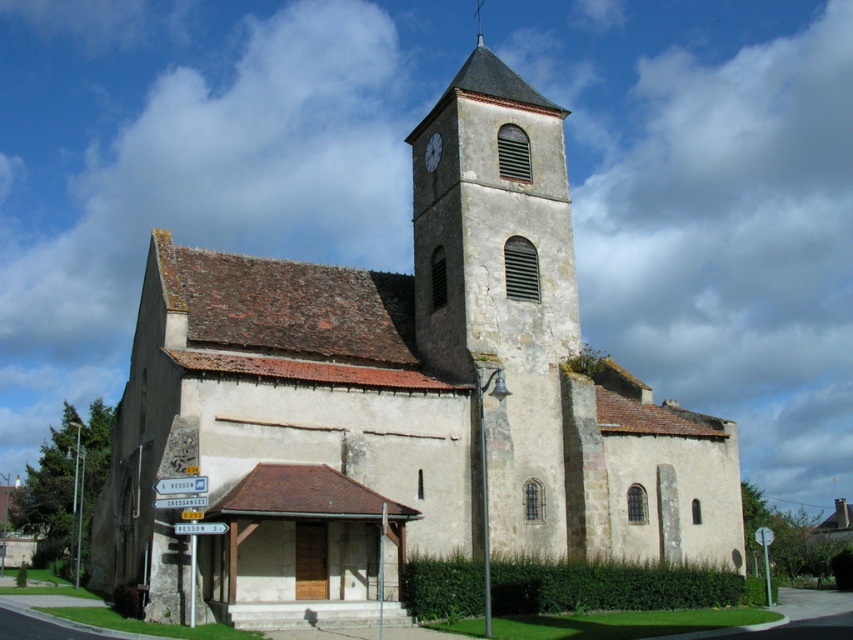
Question: Which object is farther from the camera taking this photo?

Choices:
 (A) white textured clock at upper center
 (B) smooth gray spire at upper center

Answer: (B)

Question: Is white textured clock at upper center closer to camera compared to smooth gray spire at upper center?

Choices:
 (A) yes
 (B) no

Answer: (A)

Question: Is stone clock tower at center thinner than smooth gray spire at upper center?

Choices:
 (A) yes
 (B) no

Answer: (B)

Question: Considering the real-world distances, which object is farthest from the white textured clock at upper center?

Choices:
 (A) smooth gray spire at upper center
 (B) stone clock tower at center

Answer: (A)

Question: Which object is positioned closest to the white textured clock at upper center?

Choices:
 (A) stone clock tower at center
 (B) smooth gray spire at upper center

Answer: (A)

Question: Is stone clock tower at center to the right of white textured clock at upper center from the viewer's perspective?

Choices:
 (A) no
 (B) yes

Answer: (B)